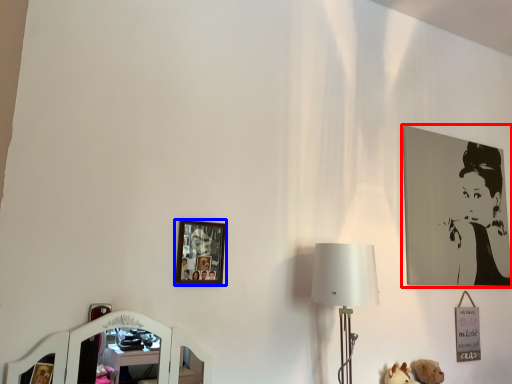
Question: Among these objects, which one is farthest to the camera, picture frame (highlighted by a red box) or picture frame (highlighted by a blue box)?

Choices:
 (A) picture frame
 (B) picture frame

Answer: (A)